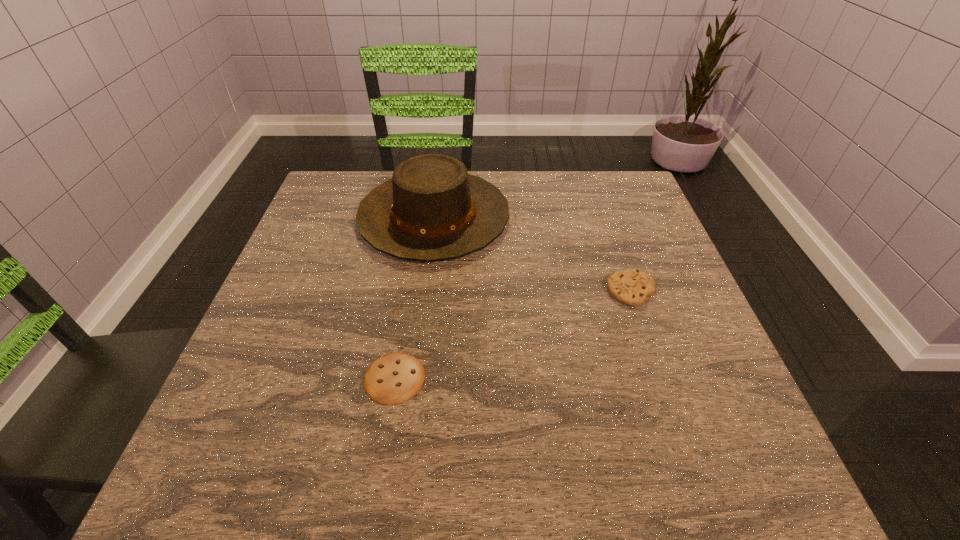
At what (x,y) coordinates should I click in order to perform the action: click on object positioned at the left edge. Please return your answer as a coordinate pair (x, y). This screenshot has height=540, width=960. Looking at the image, I should click on 431,209.

What are the coordinates of `object at the right edge` in the screenshot? It's located at coord(632,287).

Where is `object at the far left corner`? object at the far left corner is located at coordinates (431, 209).

In the image, there is a desktop. What are the coordinates of `vacant space at the far edge` in the screenshot? It's located at (544, 183).

Identify the location of free space at the near edge of the desktop. This screenshot has height=540, width=960. [564, 469].

In the image, there is a desktop. Find the location of `vacant space at the left edge`. vacant space at the left edge is located at coordinates (281, 379).

In the image, there is a desktop. In order to click on vacant region at the right edge in this screenshot , I will do `click(687, 323)`.

Find the location of a particular element. The image size is (960, 540). vacant space at the far left corner of the desktop is located at coordinates (334, 207).

In the image, there is a desktop. What are the coordinates of `vacant space at the far right corner` in the screenshot? It's located at (643, 194).

Locate an element on the screen. The width and height of the screenshot is (960, 540). unoccupied area between the nearer cookie and the second shortest object is located at coordinates (513, 334).